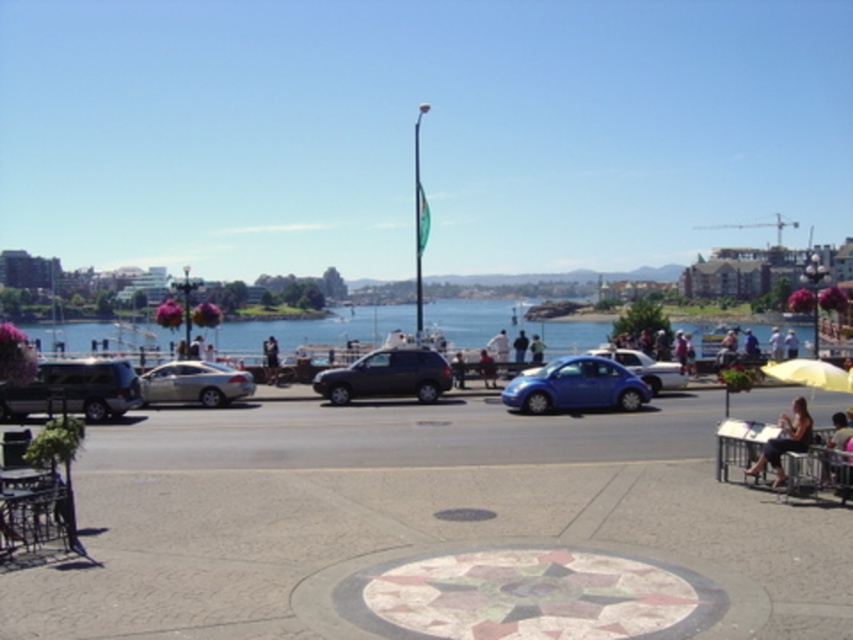
You are a delivery person carrying a package and need to place it on the light brown wooden chair at lower right. You are currently standing near the dark gray fabric jacket at center. Can you estimate how far you need to walk to reach the chair?

The light brown wooden chair at lower right is 31.06 meters from the dark gray fabric jacket at center. Therefore, you need to walk approximately 31.06 meters to reach the chair.

From the picture: You are standing at the waterfront plaza and want to place a new potted plant between the light brown wooden chair at lower right and the dark gray fabric jacket at center. Based on their positions, can you determine which object is closer to the ground?

The light brown wooden chair at lower right is below dark gray fabric jacket at center, so the light brown wooden chair at lower right is closer to the ground.

Based on the photo, you are a pedestrian standing at the edge of the waterfront plaza. You see the satin silver sedan at center and the blue matte hatchback at center. Which vehicle is positioned to the left when looking towards the street?

The satin silver sedan at center is to the left of the blue matte hatchback at center, so the satin silver sedan at center is positioned to the left when looking towards the street.